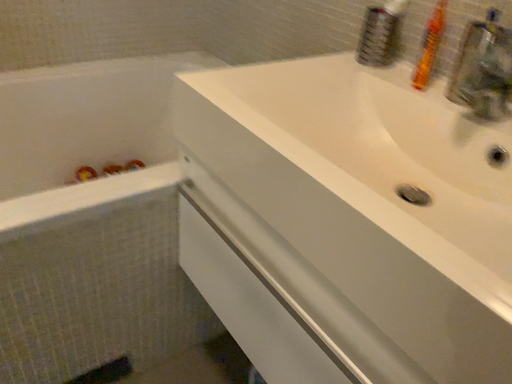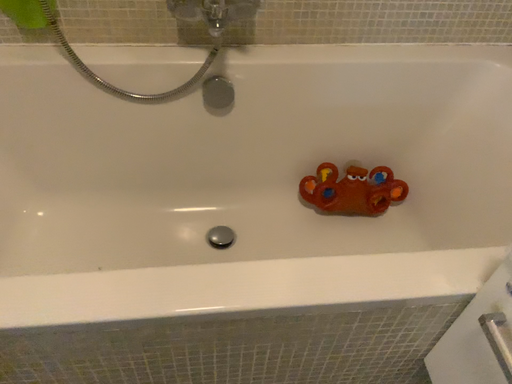
Question: Which way did the camera rotate in the video?

Choices:
 (A) rotated downward
 (B) rotated upward

Answer: (A)